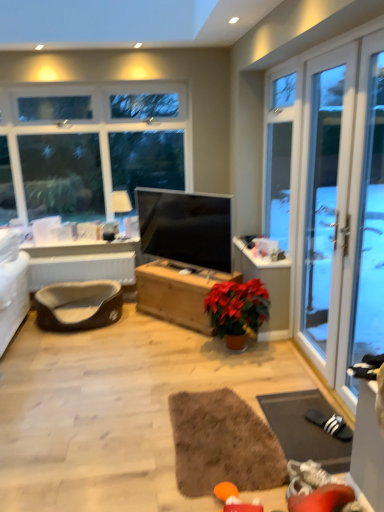
Identify the location of vacant space behind dark gray rubber yoga mat at lower right, the first yoga mat viewed from the right. Image resolution: width=384 pixels, height=512 pixels. pyautogui.click(x=271, y=376).